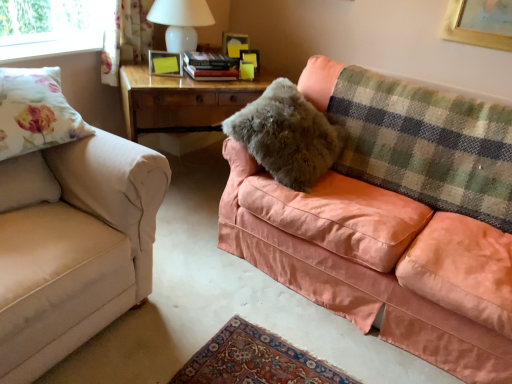
Question: Looking at the image, does matte yellow picture frame at center, the first picture frame from the bottom, seem bigger or smaller compared to floral fabric curtain at upper left?

Choices:
 (A) big
 (B) small

Answer: (B)

Question: From a real-world perspective, is matte yellow picture frame at center, placed as the first picture frame when sorted from left to right, physically located above or below floral fabric curtain at upper left?

Choices:
 (A) below
 (B) above

Answer: (A)

Question: Considering the real-world distances, which object is farthest from the white glossy table lamp at upper center?

Choices:
 (A) floral fabric pillow at left, positioned as the 1th pillow in left-to-right order
 (B) floral fabric pillow at left
 (C) beige fabric couch at left, marked as the 2th studio couch in a right-to-left arrangement
 (D) green plaid blanket at upper right
 (E) coral velvet couch at right, the 1th studio couch in the right-to-left sequence

Answer: (E)

Question: Based on their relative distances, which object is farther from the white glossy table lamp at upper center?

Choices:
 (A) coral velvet couch at right, the 1th studio couch in the right-to-left sequence
 (B) wooden table at center
 (C) floral fabric pillow at left
 (D) floral fabric curtain at upper left
 (E) floral fabric pillow at left, the 2th pillow viewed from the right

Answer: (A)